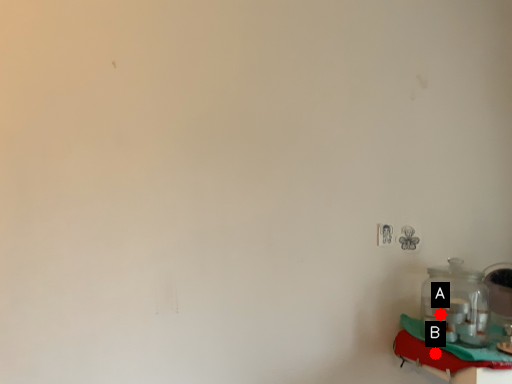
Question: Two points are circled on the image, labeled by A and B beside each circle. Which of the following is the closest to the observer?

Choices:
 (A) A is closer
 (B) B is closer

Answer: (B)